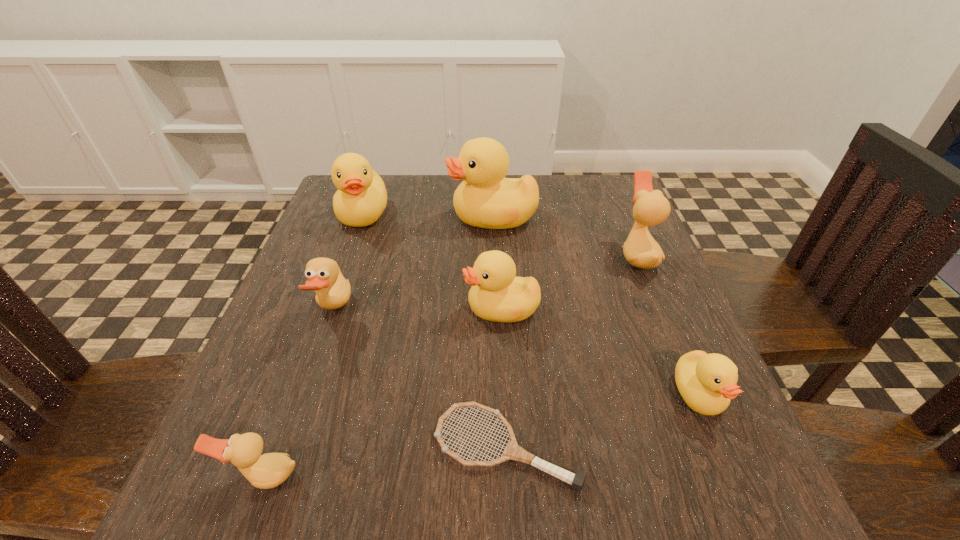
Locate an element on the screen. free point between the nearest tan duck and the second smallest tan duck is located at coordinates (299, 393).

The image size is (960, 540). Identify the location of vacant area between the smallest tan duck and the second nearest yellow duck. (382, 393).

The image size is (960, 540). I want to click on object that is the fifth closest to the smallest tan duck, so click(485, 199).

I want to click on object that stands as the second closest to the second biggest tan duck, so click(497, 295).

Find the location of `duck that is the fifth closest to the second smallest tan duck`. duck that is the fifth closest to the second smallest tan duck is located at coordinates (650, 208).

At what (x,y) coordinates should I click in order to perform the action: click on the closest duck to the tallest object. Please return your answer as a coordinate pair (x, y). Looking at the image, I should click on (361, 198).

Identify the location of yellow duck identified as the closest to the biggest yellow duck. Image resolution: width=960 pixels, height=540 pixels. [361, 198].

Identify which yellow duck is the third closest to the second smallest tan duck. Please provide its 2D coordinates. Your answer should be formatted as a tuple, i.e. [(x, y)], where the tuple contains the x and y coordinates of a point satisfying the conditions above.

[(485, 199)]

Choose which tan duck is the third nearest neighbor to the tennis racket. Please provide its 2D coordinates. Your answer should be formatted as a tuple, i.e. [(x, y)], where the tuple contains the x and y coordinates of a point satisfying the conditions above.

[(650, 208)]

In order to click on tan duck that stands as the closest to the shortest object in this screenshot , I will do `click(269, 470)`.